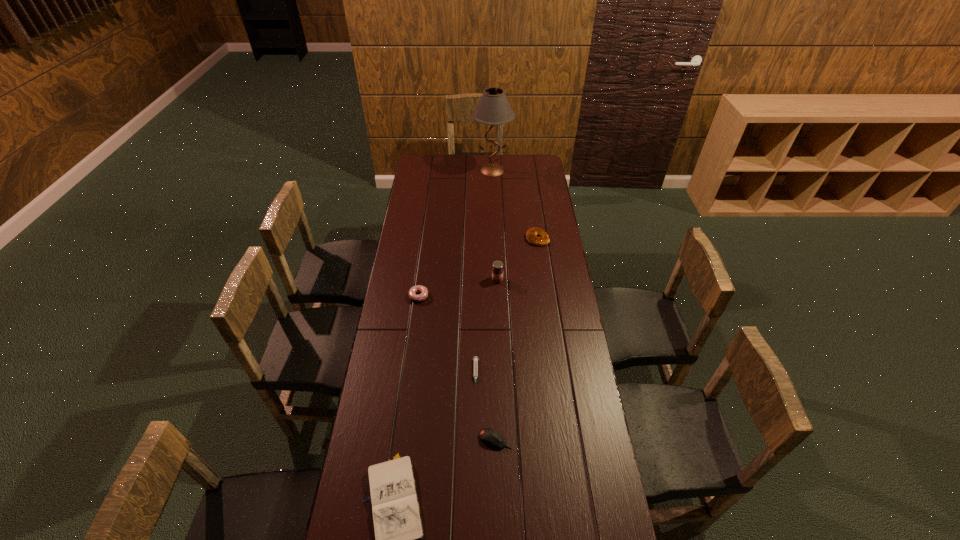
I want to click on table lamp, so click(493, 108).

At what (x,y) coordinates should I click in order to perform the action: click on the farthest object. Please return your answer as a coordinate pair (x, y). Looking at the image, I should click on (493, 108).

Where is `the fifth nearest object`? The image size is (960, 540). the fifth nearest object is located at coordinates (497, 271).

Find the location of a particular element. Image resolution: width=960 pixels, height=540 pixels. the sixth shortest object is located at coordinates 497,271.

You are a GUI agent. You are given a task and a screenshot of the screen. Output one action in this format:
    pyautogui.click(x=<x>, y=<y>)
    Task: Click on the second farthest object
    The image size is (960, 540).
    Given the screenshot: What is the action you would take?
    pyautogui.click(x=531, y=235)

Identify the location of bagel. (531, 235).

This screenshot has width=960, height=540. I want to click on doughnut, so click(423, 290).

Where is `computer mouse`? This screenshot has width=960, height=540. computer mouse is located at coordinates (488, 436).

Where is `syringe`? syringe is located at coordinates (475, 365).

Find the location of a particular element. Image resolution: width=960 pixels, height=540 pixels. the third nearest object is located at coordinates (475, 365).